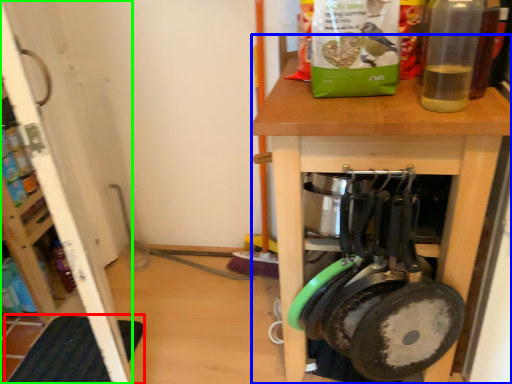
Question: Which object is positioned farthest from mat (highlighted by a red box)? Select from desk (highlighted by a blue box) and screen door (highlighted by a green box).

Choices:
 (A) desk
 (B) screen door

Answer: (A)